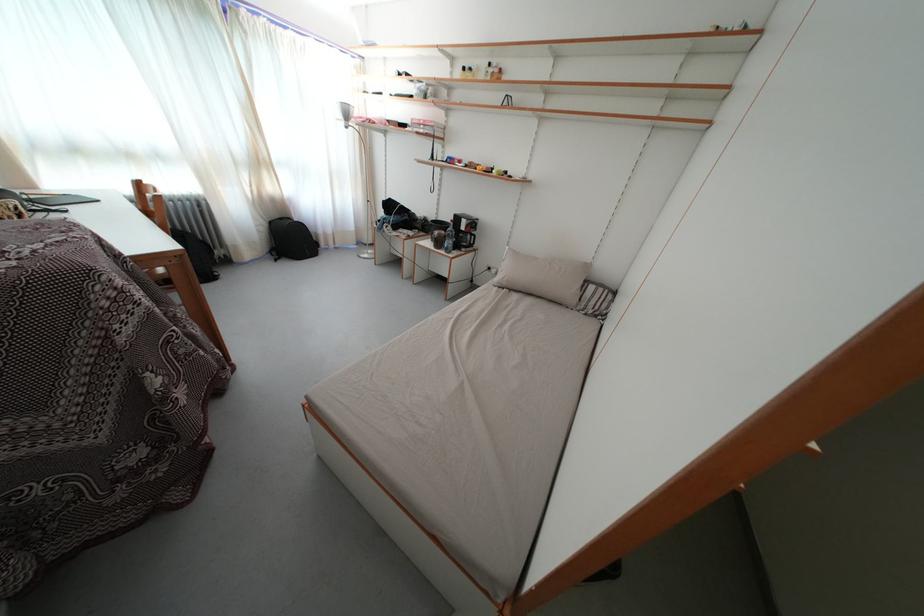
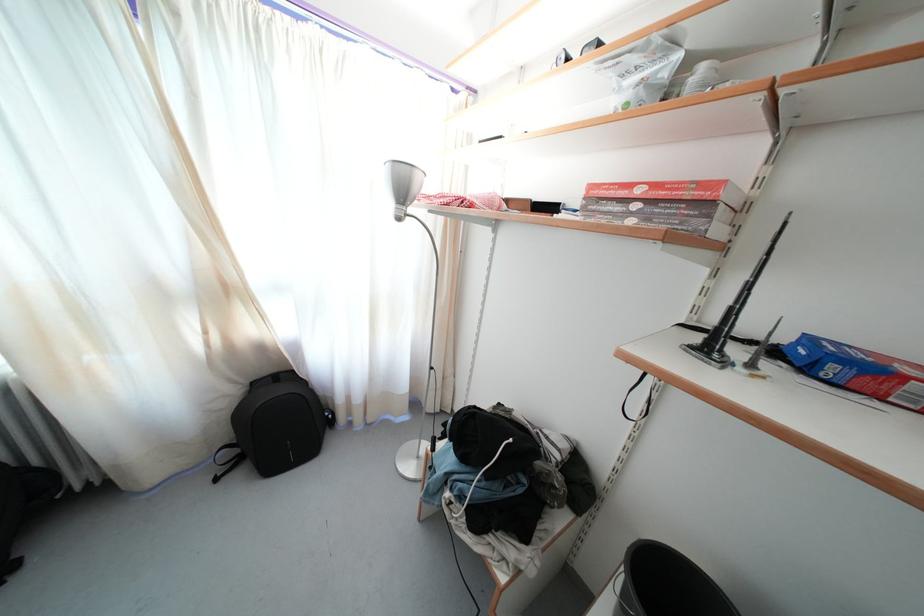
Question: What movement of the cameraman would produce the second image?

Choices:
 (A) Left
 (B) Right
 (C) Forward
 (D) Backward

Answer: (C)